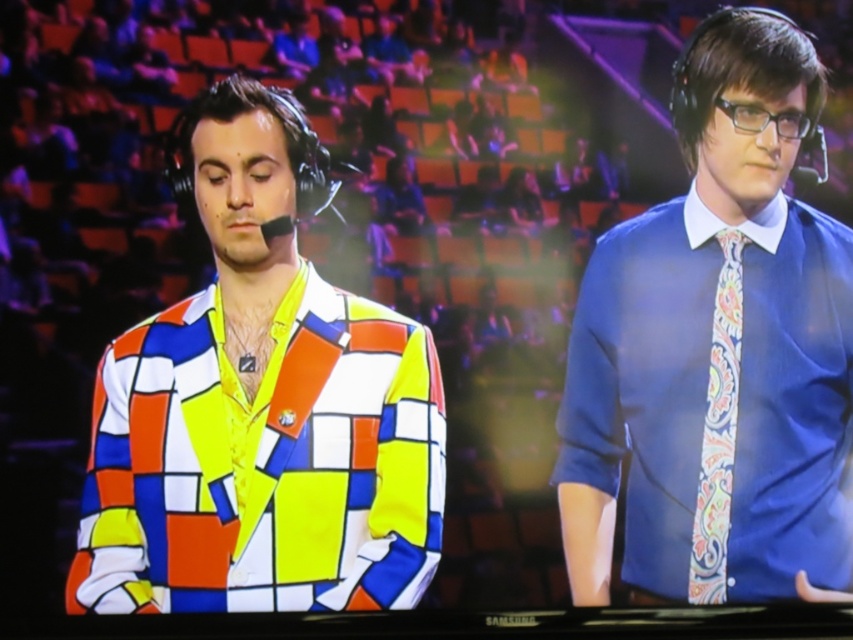
Question: Estimate the real-world distances between objects in this image. Which object is farther from the blue satin shirt at center?

Choices:
 (A) paisley-patterned silk tie at right
 (B) multicolored fabric shirt at left

Answer: (B)

Question: Which object is closer to the camera taking this photo?

Choices:
 (A) multicolored fabric shirt at left
 (B) blue satin shirt at center

Answer: (A)

Question: Can you confirm if blue satin shirt at center is smaller than paisley-patterned silk tie at right?

Choices:
 (A) no
 (B) yes

Answer: (A)

Question: Does multicolored fabric shirt at left have a larger size compared to paisley-patterned silk tie at right?

Choices:
 (A) no
 (B) yes

Answer: (B)

Question: Does blue satin shirt at center appear under paisley-patterned silk tie at right?

Choices:
 (A) no
 (B) yes

Answer: (A)

Question: Among these points, which one is nearest to the camera?

Choices:
 (A) (677, 326)
 (B) (708, 445)

Answer: (B)